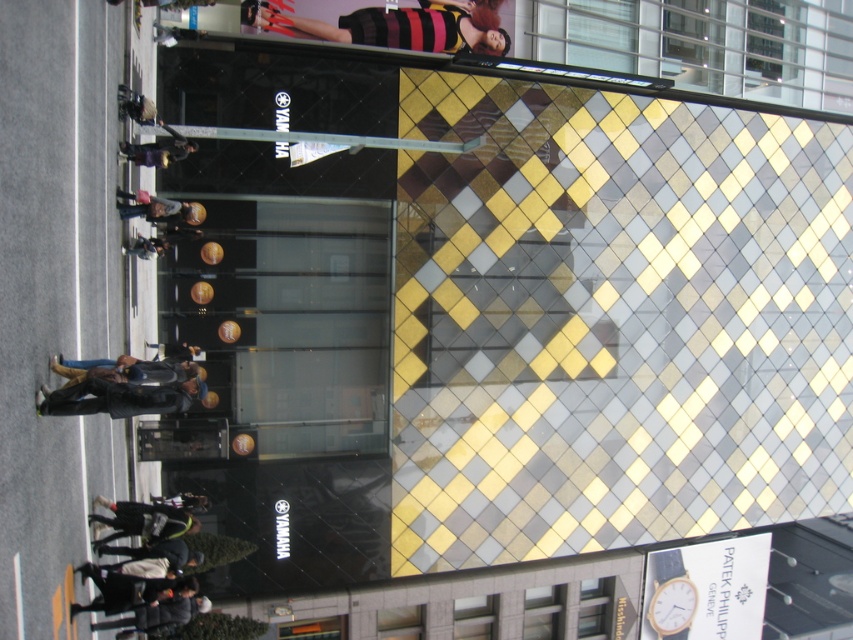
Is striped knit sweater at upper center bigger than dark brown leather jacket at upper left?

No.

From the picture: Can you confirm if striped knit sweater at upper center is positioned below dark brown leather jacket at upper left?

No.

Describe the element at coordinates (393, 26) in the screenshot. I see `striped knit sweater at upper center` at that location.

This screenshot has height=640, width=853. In order to click on striped knit sweater at upper center in this screenshot , I will do `click(393, 26)`.

Is point (469, 29) more distant than point (148, 506)?

Yes, it is.

Is striped knit sweater at upper center shorter than dark gray jacket at lower left?

Yes, striped knit sweater at upper center is shorter than dark gray jacket at lower left.

I want to click on striped knit sweater at upper center, so click(393, 26).

Image resolution: width=853 pixels, height=640 pixels. I want to click on striped knit sweater at upper center, so click(393, 26).

Is point (144, 508) farther from viewer compared to point (177, 134)?

No.

Does dark gray jacket at lower left have a lesser height compared to dark brown leather jacket at upper left?

No.

Is point (97, 515) behind point (177, 147)?

No, it is in front of (177, 147).

Locate an element on the screen. The height and width of the screenshot is (640, 853). dark gray jacket at lower left is located at coordinates (142, 520).